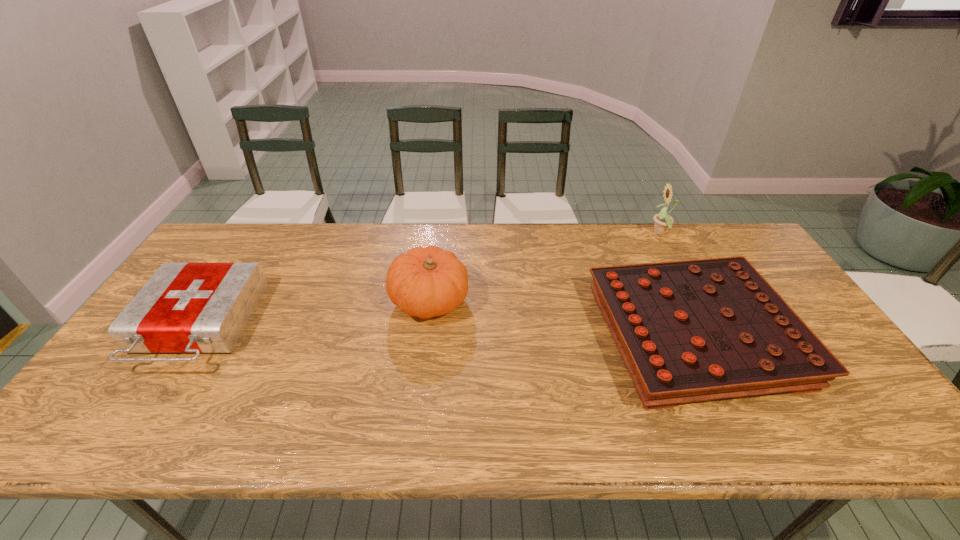
I want to click on free space at the far left corner of the desktop, so click(222, 261).

Identify the location of free point at the near right corner. (867, 417).

What are the coordinates of `free space between the pumpkin and the gameboard` in the screenshot? It's located at pos(562,319).

You are a GUI agent. You are given a task and a screenshot of the screen. Output one action in this format:
    pyautogui.click(x=<x>, y=<y>)
    Task: Click on the free spot between the pumpkin and the gameboard
    The width and height of the screenshot is (960, 540).
    Given the screenshot: What is the action you would take?
    pyautogui.click(x=562, y=319)

Find the location of a particular element. The width and height of the screenshot is (960, 540). vacant space in between the farthest object and the pumpkin is located at coordinates [545, 267].

I want to click on vacant space that is in between the farthest object and the second tallest object, so click(x=545, y=267).

Where is `empty location between the third object from right to left and the sunflower`? empty location between the third object from right to left and the sunflower is located at coordinates (545, 267).

The image size is (960, 540). I want to click on the third closest object relative to the gameboard, so 197,308.

Identify which object is the third closest to the sunflower. Please provide its 2D coordinates. Your answer should be formatted as a tuple, i.e. [(x, y)], where the tuple contains the x and y coordinates of a point satisfying the conditions above.

[(197, 308)]

At what (x,y) coordinates should I click in order to perform the action: click on free space that satisfies the following two spatial constraints: 1. on the front-facing side of the farthest object; 2. on the front side of the leftmost object. Please return your answer as a coordinate pair (x, y). The height and width of the screenshot is (540, 960). Looking at the image, I should click on (710, 326).